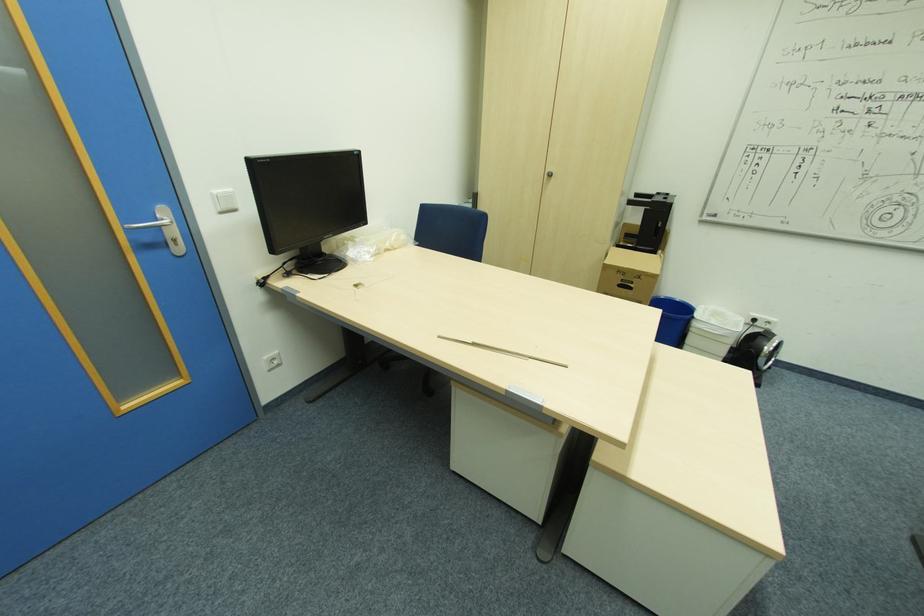
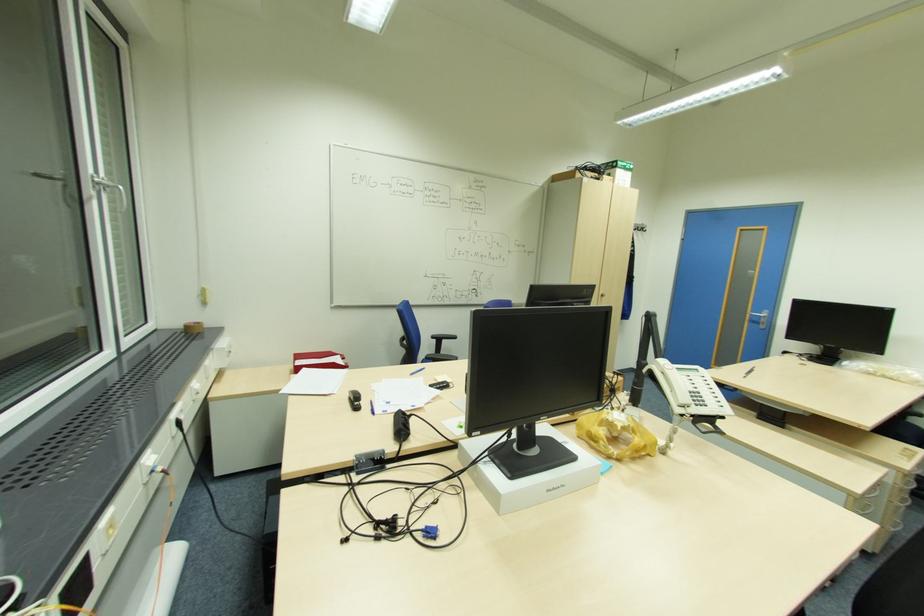
In the second image, find the point that corresponds to pixel 176 240 in the first image.

(766, 323)